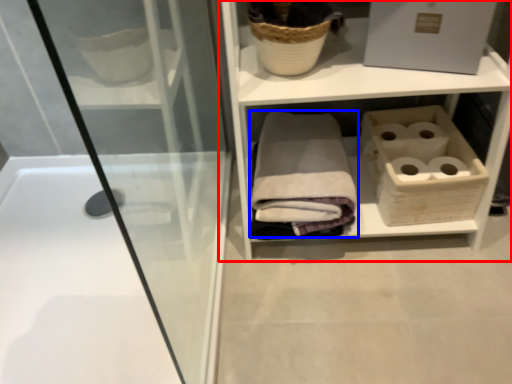
Question: Which object appears farthest to the camera in this image, shelf (highlighted by a red box) or bath towel (highlighted by a blue box)?

Choices:
 (A) shelf
 (B) bath towel

Answer: (B)